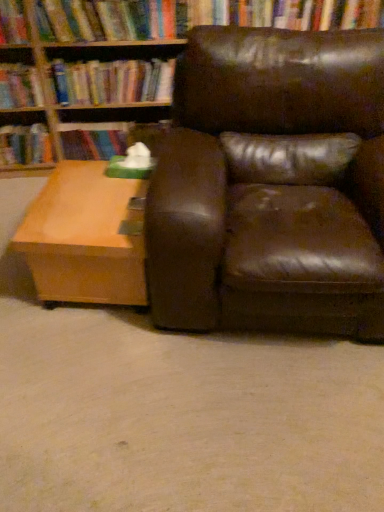
Question: Considering the relative positions of hardcover book at center, the 3th book when ordered from left to right, and hardcover book at left, which ranks as the 1th book in left-to-right order, in the image provided, is hardcover book at center, the 3th book when ordered from left to right, to the left of hardcover book at left, which ranks as the 1th book in left-to-right order, from the viewer's perspective?

Choices:
 (A) no
 (B) yes

Answer: (A)

Question: Considering the relative sizes of hardcover book at center, the 3th book when ordered from left to right, and hardcover book at left, arranged as the 4th book when viewed from the right, in the image provided, is hardcover book at center, the 3th book when ordered from left to right, shorter than hardcover book at left, arranged as the 4th book when viewed from the right,?

Choices:
 (A) yes
 (B) no

Answer: (A)

Question: Is hardcover book at center, the 3th book when ordered from left to right, behind hardcover book at left, arranged as the 4th book when viewed from the right?

Choices:
 (A) no
 (B) yes

Answer: (B)

Question: From the image's perspective, is hardcover book at center, the 3th book when ordered from left to right, located beneath hardcover book at left, arranged as the 4th book when viewed from the right?

Choices:
 (A) yes
 (B) no

Answer: (B)

Question: From the image's perspective, does hardcover book at center, the 3th book when ordered from left to right, appear higher than hardcover book at left, which ranks as the 1th book in left-to-right order?

Choices:
 (A) yes
 (B) no

Answer: (A)

Question: Considering the positions of hardcover book at left, which ranks as the 1th book in left-to-right order, and light brown wood coffee table at lower left in the image, is hardcover book at left, which ranks as the 1th book in left-to-right order, wider or thinner than light brown wood coffee table at lower left?

Choices:
 (A) thin
 (B) wide

Answer: (A)

Question: Relative to light brown wood coffee table at lower left, is hardcover book at left, which ranks as the 1th book in left-to-right order, in front or behind?

Choices:
 (A) behind
 (B) front

Answer: (A)

Question: In terms of height, does hardcover book at left, arranged as the 4th book when viewed from the right, look taller or shorter compared to light brown wood coffee table at lower left?

Choices:
 (A) short
 (B) tall

Answer: (A)

Question: Considering the positions of hardcover book at left, which ranks as the 1th book in left-to-right order, and light brown wood coffee table at lower left in the image, is hardcover book at left, which ranks as the 1th book in left-to-right order, bigger or smaller than light brown wood coffee table at lower left?

Choices:
 (A) small
 (B) big

Answer: (A)

Question: From their relative heights in the image, would you say hardcover book at upper center, which ranks as the 4th book in left-to-right order, is taller or shorter than hardcover book at left, arranged as the 4th book when viewed from the right?

Choices:
 (A) tall
 (B) short

Answer: (A)

Question: Which is correct: hardcover book at upper center, which ranks as the 4th book in left-to-right order, is inside hardcover book at left, which ranks as the 1th book in left-to-right order, or outside of it?

Choices:
 (A) outside
 (B) inside

Answer: (A)

Question: From the image's perspective, is hardcover book at upper center, which ranks as the 4th book in left-to-right order, located above or below hardcover book at left, which ranks as the 1th book in left-to-right order?

Choices:
 (A) below
 (B) above

Answer: (B)

Question: From a real-world perspective, is hardcover book at upper center, which ranks as the 4th book in left-to-right order, physically located above or below hardcover book at left, arranged as the 4th book when viewed from the right?

Choices:
 (A) above
 (B) below

Answer: (A)

Question: Relative to hardcover book at upper left, which is the second book in left-to-right order, is light brown wood coffee table at lower left in front or behind?

Choices:
 (A) behind
 (B) front

Answer: (B)

Question: From the image's perspective, is light brown wood coffee table at lower left above or below hardcover book at upper left, which is the 3th book from right to left?

Choices:
 (A) below
 (B) above

Answer: (A)